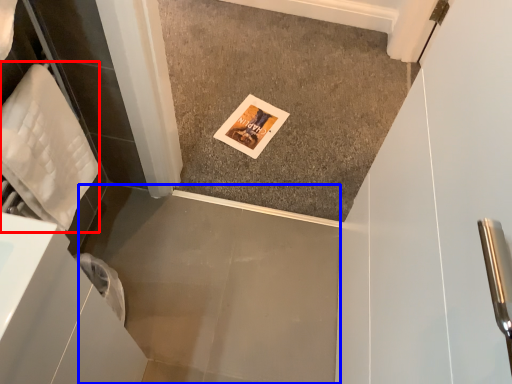
Question: Which object appears farthest to the camera in this image, material (highlighted by a red box) or concrete (highlighted by a blue box)?

Choices:
 (A) material
 (B) concrete

Answer: (B)